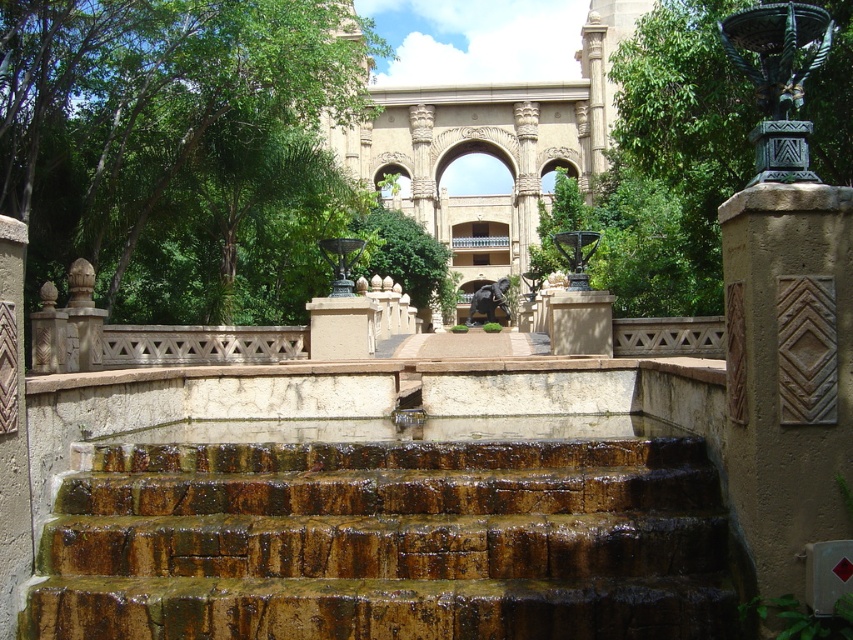
Question: Does brown stone stairs at center appear under brown textured stone at right?

Choices:
 (A) no
 (B) yes

Answer: (B)

Question: Which of the following is the closest to the observer?

Choices:
 (A) brown textured stone at right
 (B) brown stone stairs at center
 (C) sandstone archway at center

Answer: (A)

Question: Considering the real-world distances, which object is closest to the sandstone archway at center?

Choices:
 (A) brown stone stairs at center
 (B) brown textured stone at right

Answer: (A)

Question: Does brown textured stone at right have a smaller size compared to sandstone archway at center?

Choices:
 (A) no
 (B) yes

Answer: (B)

Question: Estimate the real-world distances between objects in this image. Which object is farther from the brown stone stairs at center?

Choices:
 (A) sandstone archway at center
 (B) brown textured stone at right

Answer: (A)

Question: Can you confirm if brown stone stairs at center is wider than brown textured stone at right?

Choices:
 (A) no
 (B) yes

Answer: (B)